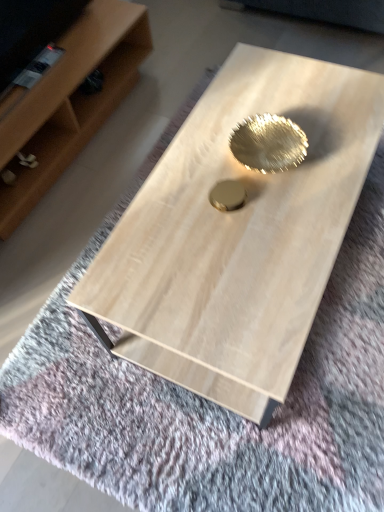
Locate an element on the screen. free location in front of light wood shelf at upper left is located at coordinates (66, 270).